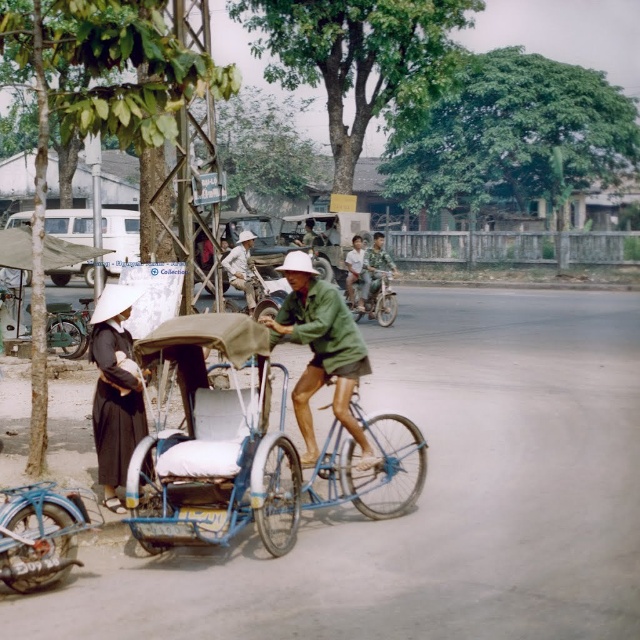
Question: Can you confirm if black matte dress at left is positioned to the left of green matte bicycle at left?

Choices:
 (A) no
 (B) yes

Answer: (A)

Question: Which of the following is the closest to the observer?

Choices:
 (A) (296, 314)
 (B) (124, 376)
 (C) (365, 250)

Answer: (B)

Question: Does wooden cart at center come behind black matte dress at left?

Choices:
 (A) yes
 (B) no

Answer: (B)

Question: Does light brown wooden stick at center have a larger size compared to light brown leather jacket at center?

Choices:
 (A) yes
 (B) no

Answer: (B)

Question: Estimate the real-world distances between objects in this image. Which object is closer to the camouflage fabric jacket at center?

Choices:
 (A) wooden cart at center
 (B) light brown wooden stick at center
 (C) green matte jacket at center

Answer: (B)

Question: Which of these objects is positioned closest to the light brown leather jacket at center?

Choices:
 (A) green matte bicycle at left
 (B) metallic silver motorcycle at center

Answer: (B)